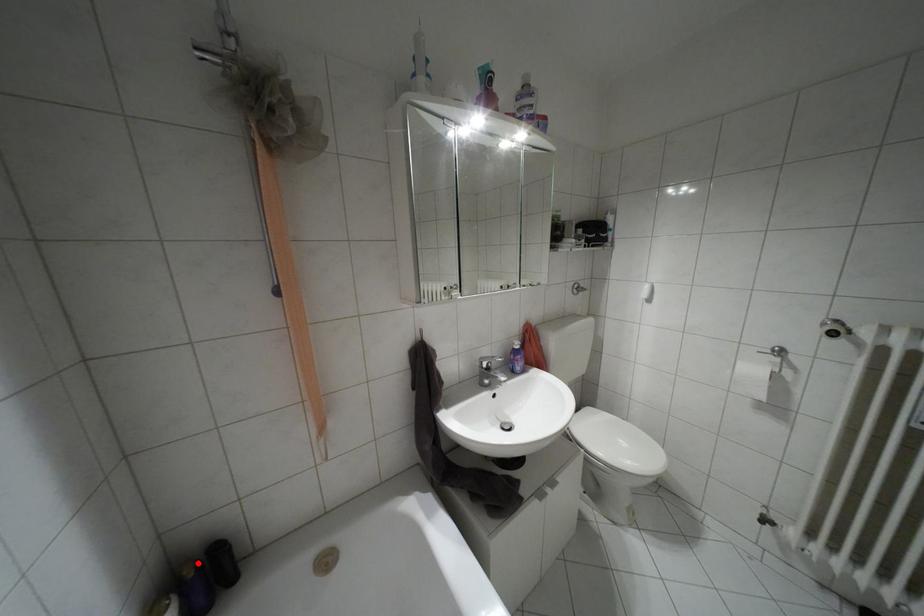
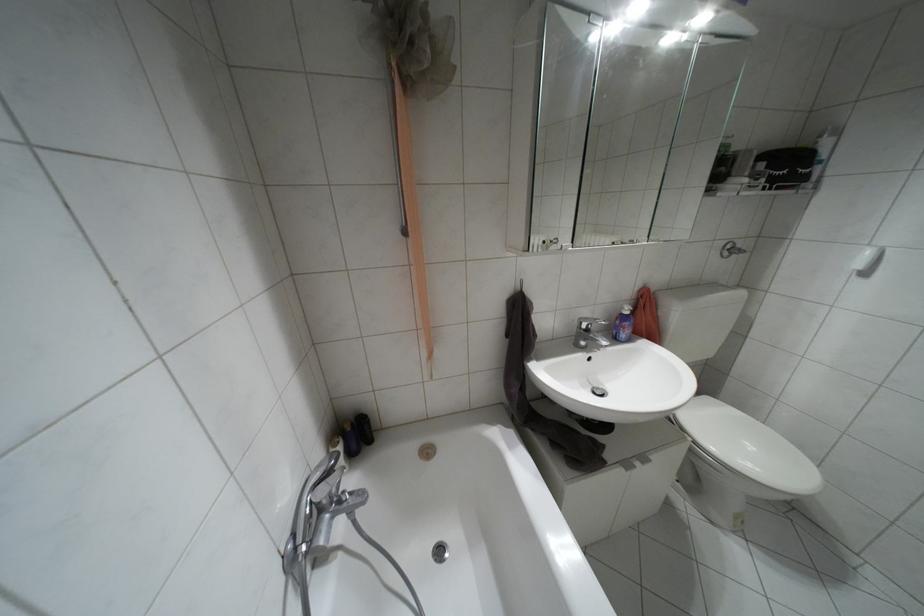
The point at the highlighted location is marked in the first image. Where is the corresponding point in the second image?

(351, 424)